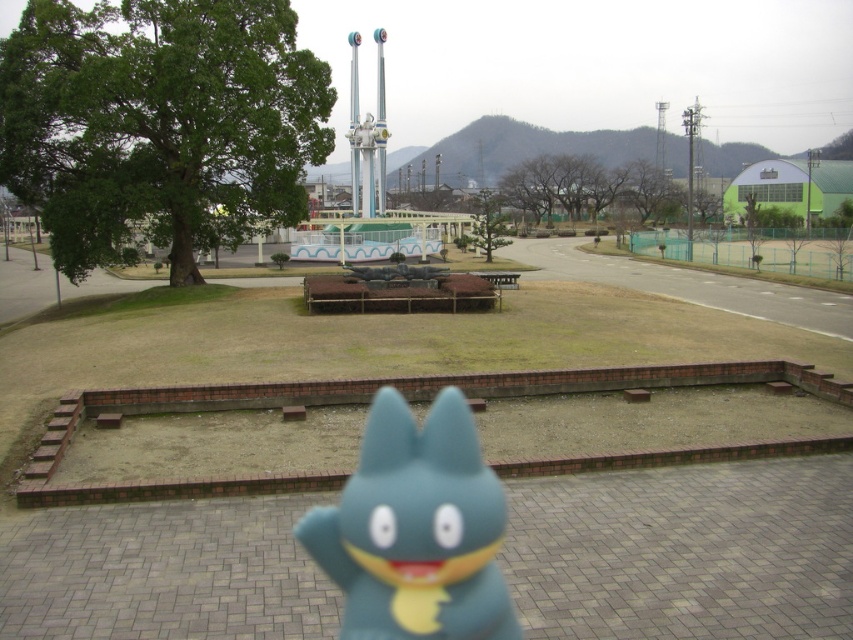
Question: Which object is closer to the camera taking this photo?

Choices:
 (A) blue rubber toy at center
 (B) wooden park bench at center

Answer: (A)

Question: Is blue rubber toy at center bigger than wooden park bench at center?

Choices:
 (A) no
 (B) yes

Answer: (A)

Question: Does blue rubber toy at center appear over wooden park bench at center?

Choices:
 (A) yes
 (B) no

Answer: (B)

Question: Does blue rubber toy at center lie behind wooden park bench at center?

Choices:
 (A) no
 (B) yes

Answer: (A)

Question: Among these objects, which one is farthest from the camera?

Choices:
 (A) blue rubber toy at center
 (B) wooden park bench at center

Answer: (B)